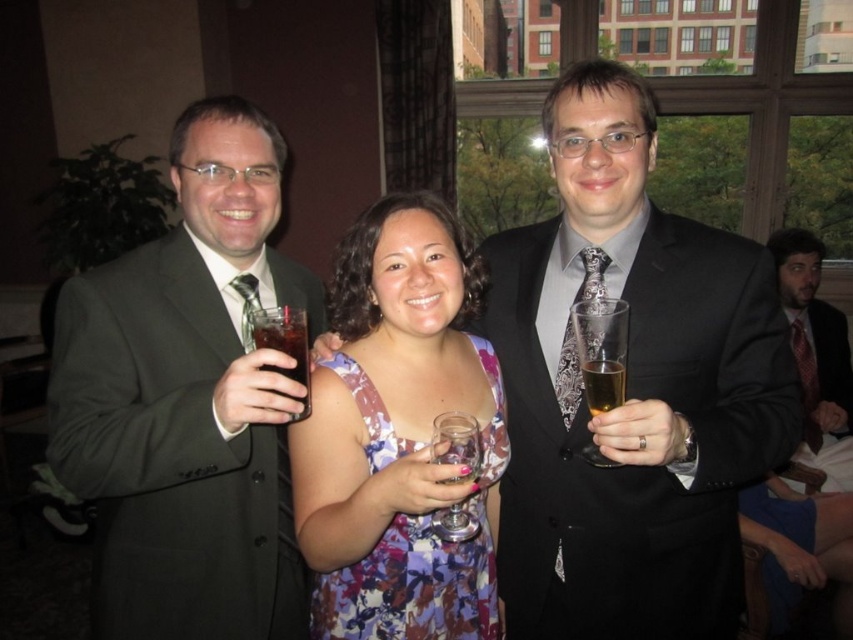
Can you confirm if matte black suit at left is wider than floral fabric dress at center?

Correct, the width of matte black suit at left exceeds that of floral fabric dress at center.

Who is higher up, matte black suit at left or floral fabric dress at center?

matte black suit at left is higher up.

Is point (178, 435) behind point (369, 609)?

No, (178, 435) is closer to viewer.

At what (x,y) coordinates should I click in order to perform the action: click on matte black suit at left. Please return your answer as a coordinate pair (x, y). This screenshot has width=853, height=640. Looking at the image, I should click on point(189,401).

Can you confirm if clear glass at right is wider than dark brown liquid at upper left?

No.

Is clear glass at right in front of dark brown liquid at upper left?

Yes, clear glass at right is closer to the viewer.

Which is behind, point (622, 337) or point (305, 381)?

Point (305, 381)

In order to click on clear glass at right in this screenshot , I will do `click(601, 349)`.

Does clear glass at right lie behind clear glass wine glass at center?

Yes, it is behind clear glass wine glass at center.

Based on the photo, between clear glass at right and clear glass wine glass at center, which one appears on the left side from the viewer's perspective?

clear glass wine glass at center is more to the left.

Where is `clear glass at right`? The width and height of the screenshot is (853, 640). clear glass at right is located at coordinates (601, 349).

This screenshot has width=853, height=640. I want to click on clear glass at right, so click(601, 349).